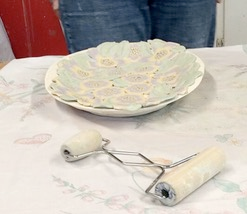
The width and height of the screenshot is (247, 214). Find the location of `wall`. wall is located at coordinates (241, 16).